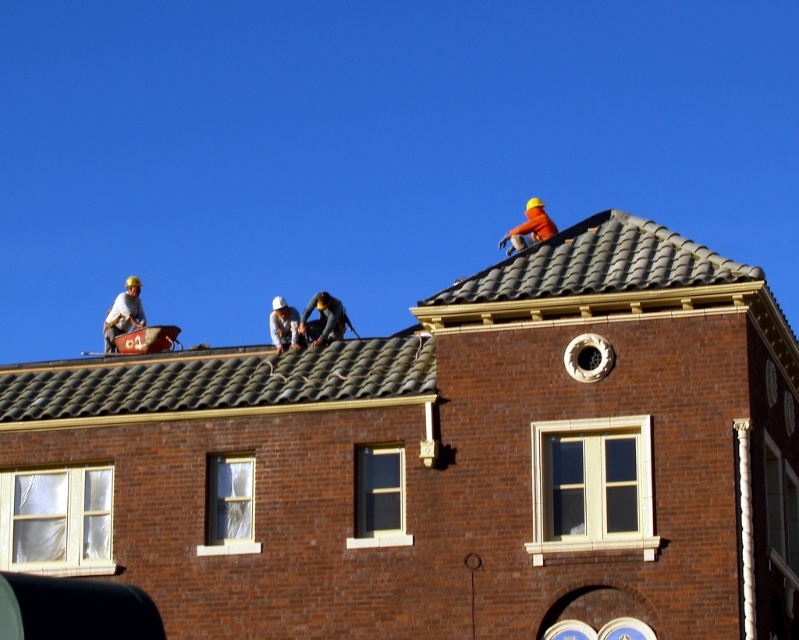
Question: Which object appears farthest from the camera in this image?

Choices:
 (A) matte black helmet at upper left
 (B) dark gray fabric at center
 (C) white hard hat at center
 (D) brown tile roof at upper center

Answer: (A)

Question: Which object is farther from the camera taking this photo?

Choices:
 (A) orange hard hat at upper center
 (B) brown tile roof at upper center
 (C) dark gray fabric at center
 (D) matte black helmet at upper left

Answer: (D)

Question: In this image, where is matte black helmet at upper left located relative to orange hard hat at upper center?

Choices:
 (A) above
 (B) below

Answer: (B)

Question: Which object is closer to the camera taking this photo?

Choices:
 (A) dark gray fabric at center
 (B) white hard hat at center
 (C) orange hard hat at upper center
 (D) matte black helmet at upper left

Answer: (A)

Question: Is brown tile roof at upper center above white hard hat at center?

Choices:
 (A) yes
 (B) no

Answer: (B)

Question: Is brown tile roof at upper center wider than white hard hat at center?

Choices:
 (A) yes
 (B) no

Answer: (A)